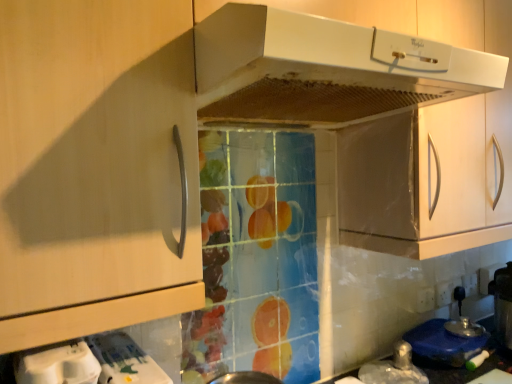
Question: Is white matte range hood at upper center at the back of white plastic container at lower left, positioned as the first appliance in top-to-bottom order?

Choices:
 (A) no
 (B) yes

Answer: (A)

Question: Is white plastic container at lower left, marked as the third appliance in a back-to-front arrangement, beside white matte range hood at upper center?

Choices:
 (A) no
 (B) yes

Answer: (A)

Question: Considering the relative sizes of white plastic container at lower left, marked as the third appliance in a back-to-front arrangement, and white matte range hood at upper center in the image provided, is white plastic container at lower left, marked as the third appliance in a back-to-front arrangement, thinner than white matte range hood at upper center?

Choices:
 (A) yes
 (B) no

Answer: (A)

Question: Does white plastic container at lower left, the third appliance viewed from the right, appear on the right side of white matte range hood at upper center?

Choices:
 (A) yes
 (B) no

Answer: (B)

Question: From the image's perspective, is white plastic container at lower left, marked as the first appliance in a front-to-back arrangement, on top of white matte range hood at upper center?

Choices:
 (A) yes
 (B) no

Answer: (B)

Question: Based on their positions, is white plastic container at lower left, positioned as the first appliance in top-to-bottom order, located to the left or right of white matte range hood at upper center?

Choices:
 (A) right
 (B) left

Answer: (B)

Question: Considering the positions of white plastic container at lower left, positioned as the first appliance in left-to-right order, and white matte range hood at upper center in the image, is white plastic container at lower left, positioned as the first appliance in left-to-right order, bigger or smaller than white matte range hood at upper center?

Choices:
 (A) big
 (B) small

Answer: (B)

Question: From a real-world perspective, is white plastic container at lower left, marked as the first appliance in a front-to-back arrangement, physically located above or below white matte range hood at upper center?

Choices:
 (A) below
 (B) above

Answer: (A)

Question: Considering the positions of white plastic container at lower left, marked as the first appliance in a front-to-back arrangement, and white matte range hood at upper center in the image, is white plastic container at lower left, marked as the first appliance in a front-to-back arrangement, wider or thinner than white matte range hood at upper center?

Choices:
 (A) thin
 (B) wide

Answer: (A)

Question: Is white plastic container at lower left, the third appliance viewed from the right, wider or thinner than blue plastic lid at lower right, arranged as the first appliance when viewed from the back?

Choices:
 (A) thin
 (B) wide

Answer: (B)

Question: Considering the relative positions of white plastic container at lower left, marked as the first appliance in a front-to-back arrangement, and blue plastic lid at lower right, the 3th appliance in the top-to-bottom sequence, in the image provided, is white plastic container at lower left, marked as the first appliance in a front-to-back arrangement, to the left or to the right of blue plastic lid at lower right, the 3th appliance in the top-to-bottom sequence,?

Choices:
 (A) left
 (B) right

Answer: (A)

Question: Considering their positions, is white plastic container at lower left, the third appliance viewed from the right, located in front of or behind blue plastic lid at lower right, marked as the 1th appliance in a right-to-left arrangement?

Choices:
 (A) behind
 (B) front

Answer: (B)

Question: From the image's perspective, relative to blue plastic lid at lower right, arranged as the first appliance when viewed from the back, is white plastic container at lower left, marked as the first appliance in a front-to-back arrangement, above or below?

Choices:
 (A) above
 (B) below

Answer: (A)

Question: Does point (118, 334) appear closer or farther from the camera than point (369, 87)?

Choices:
 (A) closer
 (B) farther

Answer: (B)

Question: Choose the correct answer: Is white glossy water at lower left, which ranks as the 2th appliance in right-to-left order, inside white matte range hood at upper center or outside it?

Choices:
 (A) inside
 (B) outside

Answer: (B)